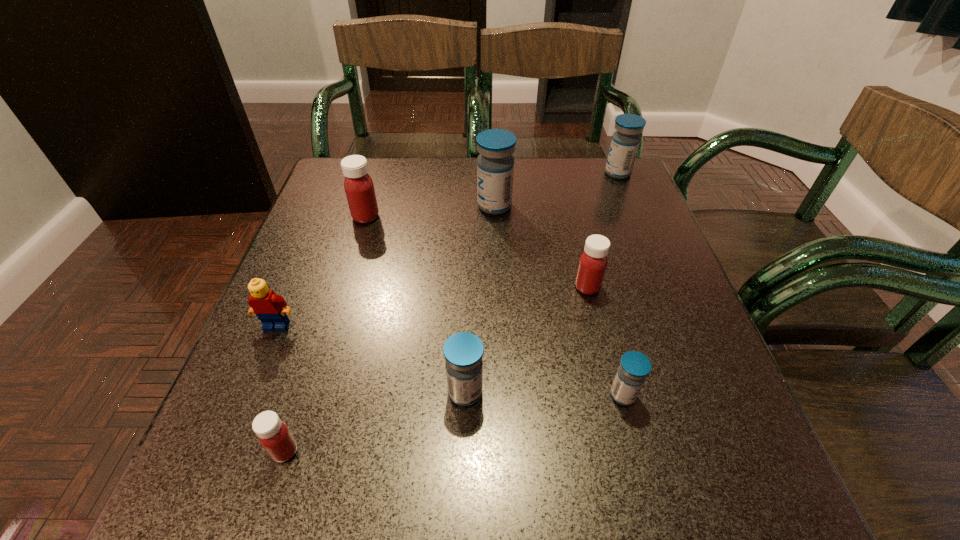
Locate an element on the screen. This screenshot has height=540, width=960. the smallest blue medicine is located at coordinates (634, 367).

You are a GUI agent. You are given a task and a screenshot of the screen. Output one action in this format:
    pyautogui.click(x=<x>, y=<y>)
    Task: Click on the nearest object
    
    Given the screenshot: What is the action you would take?
    pyautogui.click(x=275, y=437)

Identify the location of the nearest red medicine. The height and width of the screenshot is (540, 960). (275, 437).

Where is `vacant space located 0.360m on the front of the tallest medicine`? vacant space located 0.360m on the front of the tallest medicine is located at coordinates (500, 338).

At what (x,y) coordinates should I click in order to perform the action: click on free space located 0.090m on the front of the rightmost medicine. Please return your answer as a coordinate pair (x, y). This screenshot has height=540, width=960. Looking at the image, I should click on (629, 200).

Identify the location of vacant space located on the front of the farthest red medicine. The image size is (960, 540). (350, 267).

What are the coordinates of `blank space located on the back of the fifth nearest object` in the screenshot? It's located at 576,240.

Image resolution: width=960 pixels, height=540 pixels. I want to click on vacant space situated 0.200m on the right of the second smallest blue medicine, so click(606, 392).

Image resolution: width=960 pixels, height=540 pixels. Identify the location of vacant position located 0.150m on the front-facing side of the Lego. (243, 406).

The height and width of the screenshot is (540, 960). In order to click on vacant region located on the front of the second blue medicine from right to left in this screenshot , I will do `click(636, 444)`.